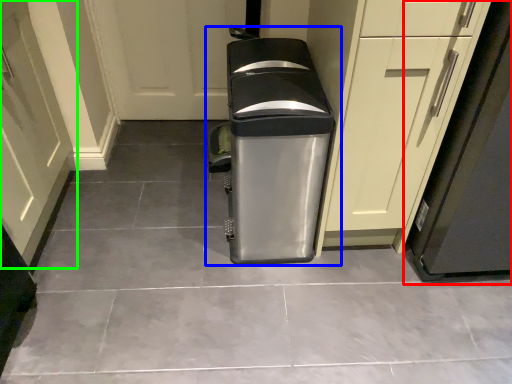
Question: Estimate the real-world distances between objects in this image. Which object is farther from appliance (highlighted by a red box), waste container (highlighted by a blue box) or door (highlighted by a green box)?

Choices:
 (A) waste container
 (B) door

Answer: (B)